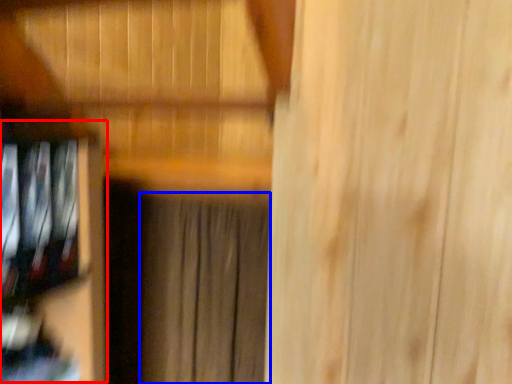
Question: Which of the following is the farthest to the observer, shelf (highlighted by a red box) or curtain (highlighted by a blue box)?

Choices:
 (A) shelf
 (B) curtain

Answer: (B)